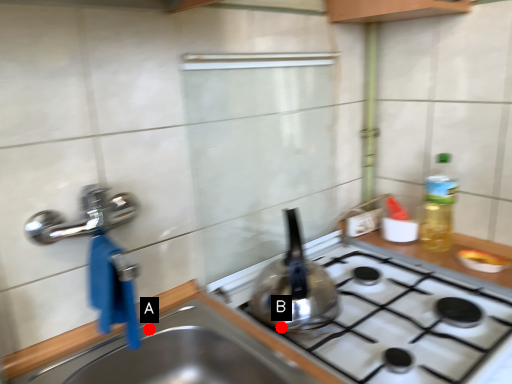
Question: Two points are circled on the image, labeled by A and B beside each circle. Among these points, which one is nearest to the camera?

Choices:
 (A) A is closer
 (B) B is closer

Answer: (B)